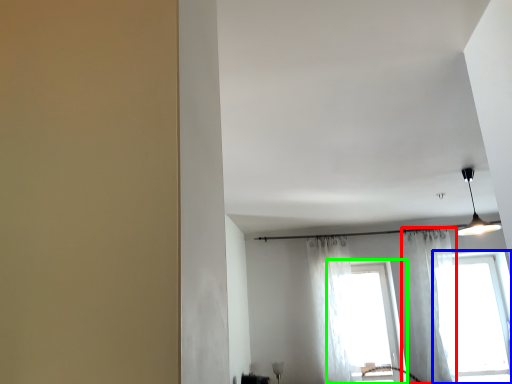
Question: Based on their relative distances, which object is farther from curtain (highlighted by a red box)? Choose from window (highlighted by a blue box) and window (highlighted by a green box).

Choices:
 (A) window
 (B) window

Answer: (B)